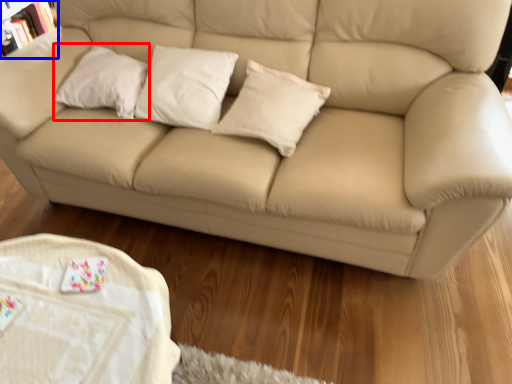
Question: Which of the following is the farthest to the observer, pillow (highlighted by a red box) or bookcase (highlighted by a blue box)?

Choices:
 (A) pillow
 (B) bookcase

Answer: (B)